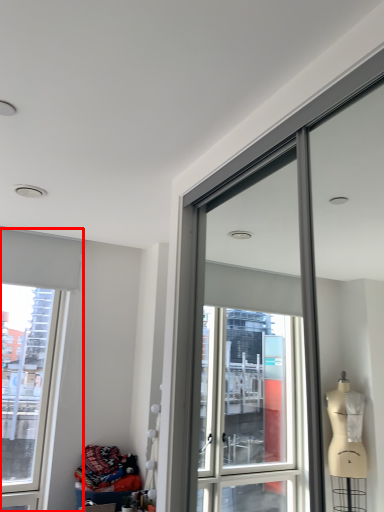
Question: From the image's perspective, where is window (annotated by the red box) located relative to material?

Choices:
 (A) above
 (B) below

Answer: (A)